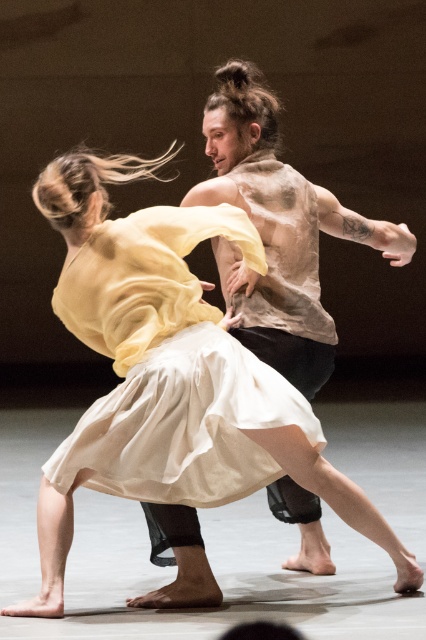
Based on the photo, who is lower down, matte yellow fabric at center or translucent beige shirt at center?

Positioned lower is matte yellow fabric at center.

Between matte yellow fabric at center and translucent beige shirt at center, which one appears on the right side from the viewer's perspective?

translucent beige shirt at center is more to the right.

This screenshot has width=426, height=640. In order to click on matte yellow fabric at center in this screenshot , I will do pos(150,360).